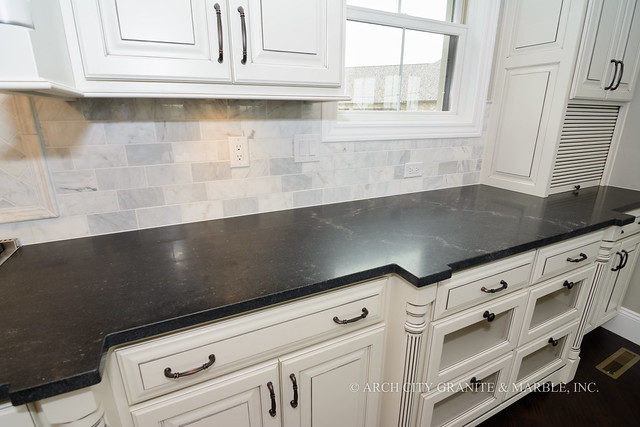
The width and height of the screenshot is (640, 427). Find the location of `electrical outlet`. electrical outlet is located at coordinates (240, 154).